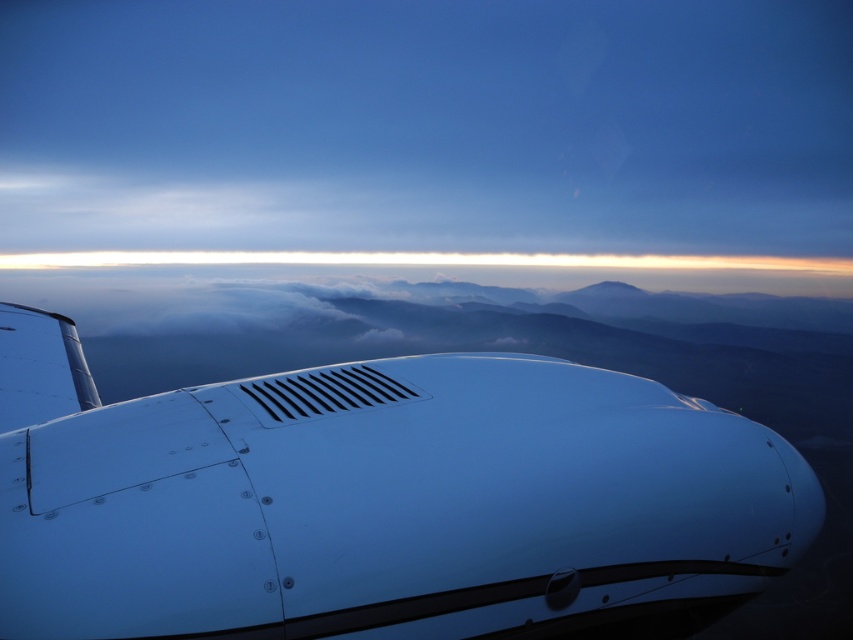
Question: Which of the following is the farthest from the observer?

Choices:
 (A) (351, 390)
 (B) (200, 634)

Answer: (A)

Question: Considering the relative positions of metallic blue airplane at lower left and metallic vent at center in the image provided, where is metallic blue airplane at lower left located with respect to metallic vent at center?

Choices:
 (A) above
 (B) below

Answer: (B)

Question: Is metallic blue airplane at lower left bigger than metallic vent at center?

Choices:
 (A) yes
 (B) no

Answer: (A)

Question: Does metallic blue airplane at lower left have a smaller size compared to metallic vent at center?

Choices:
 (A) yes
 (B) no

Answer: (B)